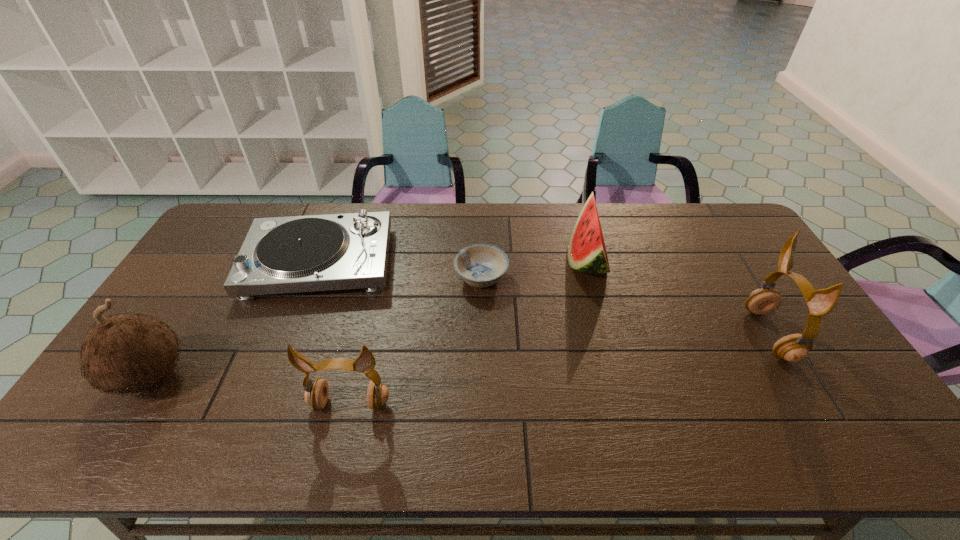
Please mark a free spot for a new earphone to balance the arrangement. Please provide its 2D coordinates. Your answer should be formatted as a tuple, i.e. [(x, y)], where the tuple contains the x and y coordinates of a point satisfying the conditions above.

[(574, 367)]